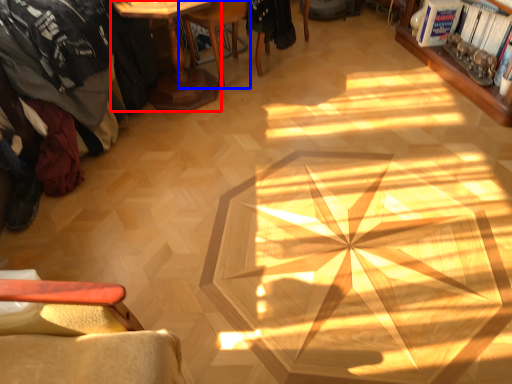
Question: Which point is closer to the camera, table (highlighted by a red box) or chair (highlighted by a blue box)?

Choices:
 (A) table
 (B) chair

Answer: (A)